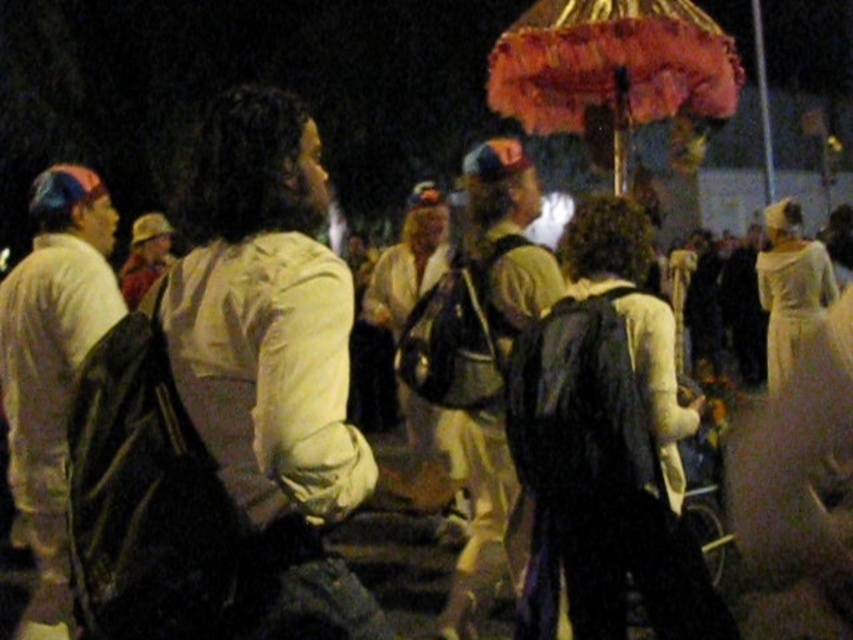
Does white matte jacket at center have a lesser width compared to matte khaki shirt at center?

No.

Consider the image. Which is above, white matte jacket at center or matte khaki shirt at center?

white matte jacket at center is above.

The image size is (853, 640). What are the coordinates of `white matte jacket at center` in the screenshot? It's located at click(271, 362).

Does white matte jacket at center come in front of velvet-like orange umbrella at upper center?

Yes.

Who is positioned more to the right, white matte jacket at center or velvet-like orange umbrella at upper center?

From the viewer's perspective, velvet-like orange umbrella at upper center appears more on the right side.

Find the location of a particular element. The width and height of the screenshot is (853, 640). white matte jacket at center is located at coordinates (271, 362).

Find the location of a particular element. white matte jacket at center is located at coordinates (271, 362).

Identify the location of matte black backpack at left. Image resolution: width=853 pixels, height=640 pixels. (51, 365).

Does matte black backpack at left have a larger size compared to velvet-like orange umbrella at upper center?

Incorrect, matte black backpack at left is not larger than velvet-like orange umbrella at upper center.

Who is more distant from viewer, (57,300) or (573,20)?

Point (573,20)

Find the location of `matte black backpack at left`. matte black backpack at left is located at coordinates click(x=51, y=365).